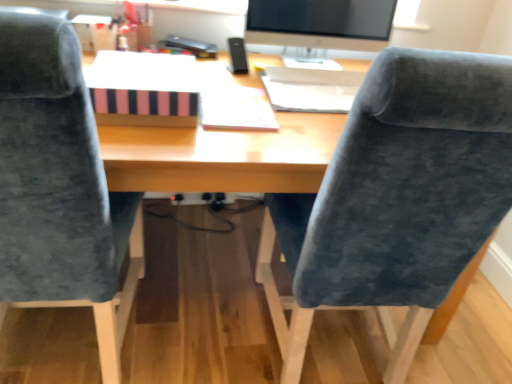
This screenshot has height=384, width=512. In order to click on free point in front of pink striped paper at center, positioned as the first book in left-to-right order in this screenshot , I will do `click(157, 144)`.